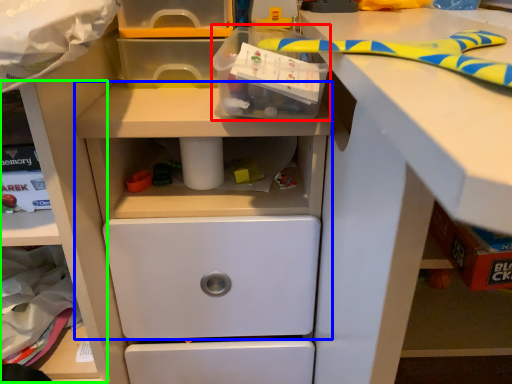
Question: Which object is positioned farthest from box (highlighted by a red box)? Select from workbench (highlighted by a blue box) and shelf (highlighted by a green box).

Choices:
 (A) workbench
 (B) shelf

Answer: (B)